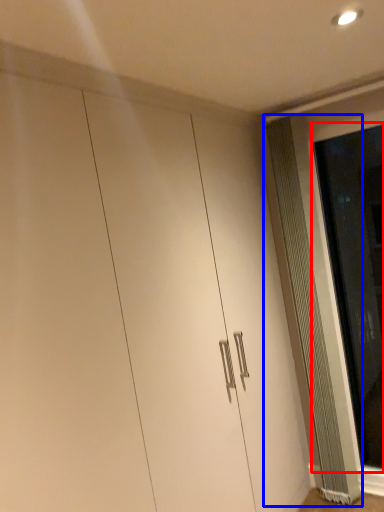
Question: Which point is further to the camera, screen door (highlighted by a red box) or radiator (highlighted by a blue box)?

Choices:
 (A) screen door
 (B) radiator

Answer: (B)